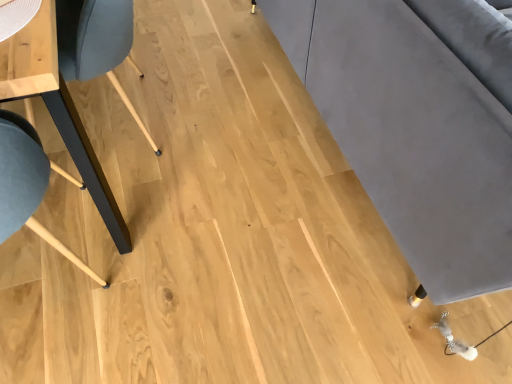
Question: Is velvet grey couch at right wider or thinner than matte wood table at left?

Choices:
 (A) wide
 (B) thin

Answer: (A)

Question: Is velvet grey couch at right inside or outside of matte wood table at left?

Choices:
 (A) inside
 (B) outside

Answer: (B)

Question: Considering their positions, is velvet grey couch at right located in front of or behind matte wood table at left?

Choices:
 (A) front
 (B) behind

Answer: (A)

Question: In terms of width, does matte wood table at left look wider or thinner when compared to velvet grey couch at right?

Choices:
 (A) wide
 (B) thin

Answer: (B)

Question: Is matte wood table at left inside the boundaries of velvet grey couch at right, or outside?

Choices:
 (A) outside
 (B) inside

Answer: (A)

Question: From the image's perspective, is matte wood table at left positioned above or below velvet grey couch at right?

Choices:
 (A) below
 (B) above

Answer: (A)

Question: From a real-world perspective, relative to velvet grey couch at right, is matte wood table at left vertically above or below?

Choices:
 (A) above
 (B) below

Answer: (B)